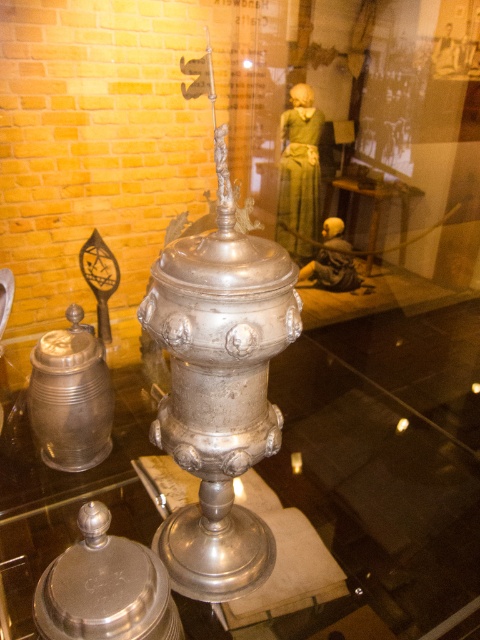
You are a museum visitor who wants to know if the polished silver teapot at lower left can fit inside the polished silver tankard at left. Based on their sizes, what do you think?

The polished silver teapot at lower left has a lesser height compared to the polished silver tankard at left, so it is possible that the teapot could fit inside the tankard if the opening is wide enough. However, the description only mentions height, not width, so further measurements would be needed to confirm.